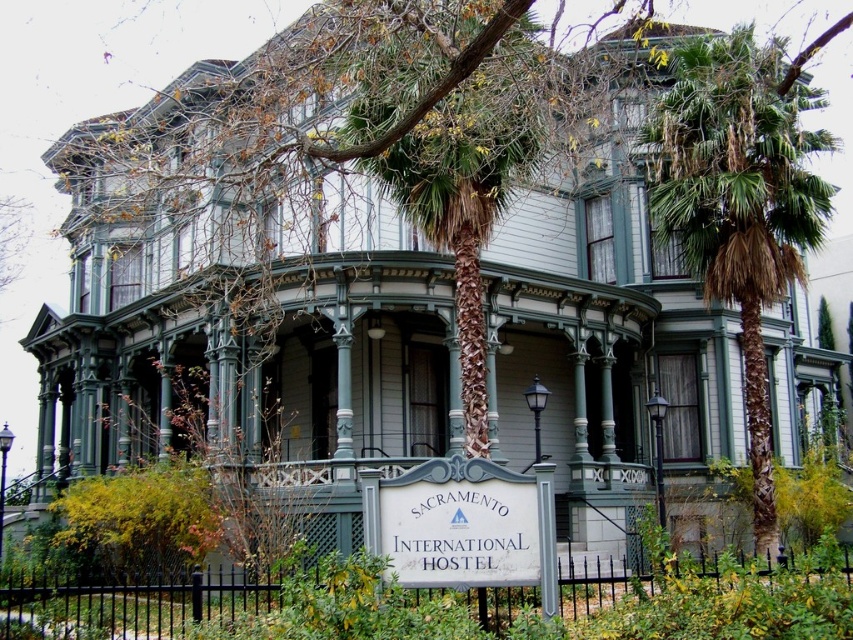
In the scene shown: You are standing in front of the Sacramento International Hostel and want to take a photo that includes both the point at coordinates point (456, 304) and point (427, 493). Since you want the closer point to be in focus, which point should you focus on?

Point (456, 304) is further to the viewer than point (427, 493), so you should focus on point (427, 493) because it is closer to you.